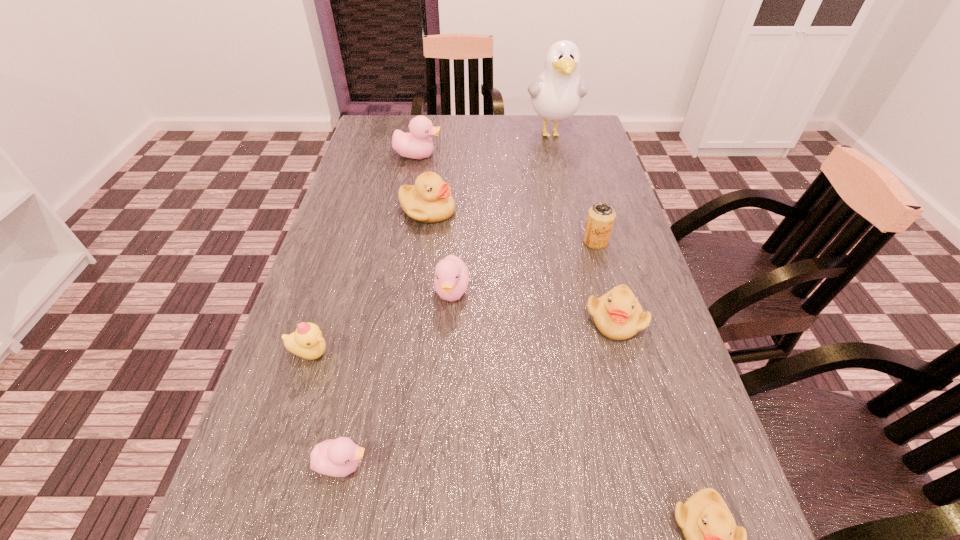
Identify the location of free space at the far right corner of the desktop. Image resolution: width=960 pixels, height=540 pixels. (579, 124).

This screenshot has width=960, height=540. I want to click on free space that is in between the second farthest pink duckling and the second nearest duckling, so click(397, 378).

You are a GUI agent. You are given a task and a screenshot of the screen. Output one action in this format:
    pyautogui.click(x=<x>, y=<y>)
    Task: Click on the vacant area that lies between the nearest pink duckling and the biggest pink duckling
    
    Given the screenshot: What is the action you would take?
    pyautogui.click(x=380, y=310)

The image size is (960, 540). I want to click on free area in between the farthest duckling and the tallest object, so click(485, 144).

The image size is (960, 540). What are the coordinates of `vacant area that lies between the beer can and the second farthest pink duckling` in the screenshot? It's located at (523, 267).

Identify the location of free spot between the second farthest pink duckling and the farthest pink duckling. The width and height of the screenshot is (960, 540). (435, 224).

Identify the location of vacant space that's between the tallest object and the leftmost duckling. (431, 243).

This screenshot has height=540, width=960. In order to click on object that ranks as the closest to the biggest yellow duckling in this screenshot , I will do `click(417, 144)`.

Identify the location of object that is the closest to the biggest pink duckling. (429, 200).

Identify the location of the fourth closest duckling relative to the gull. This screenshot has height=540, width=960. (618, 315).